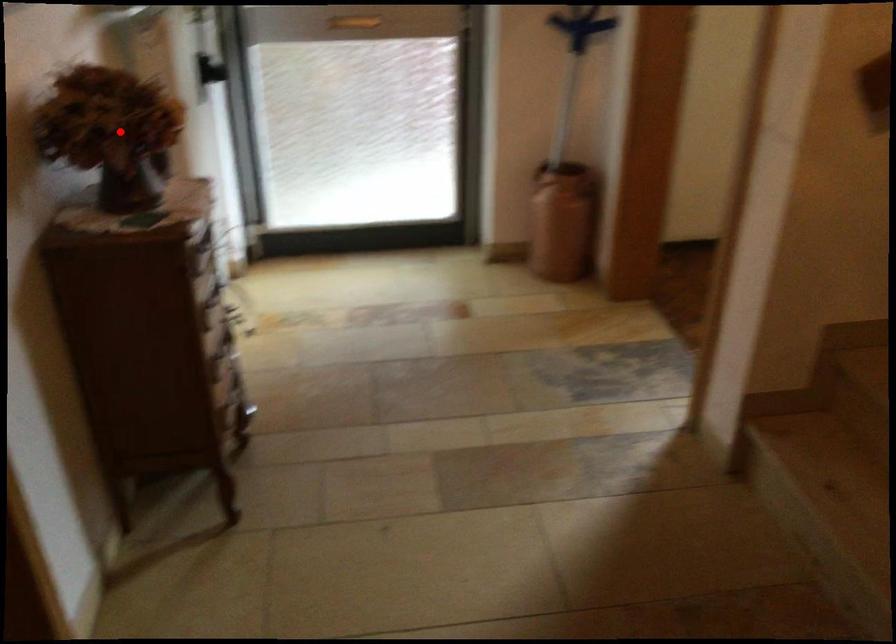
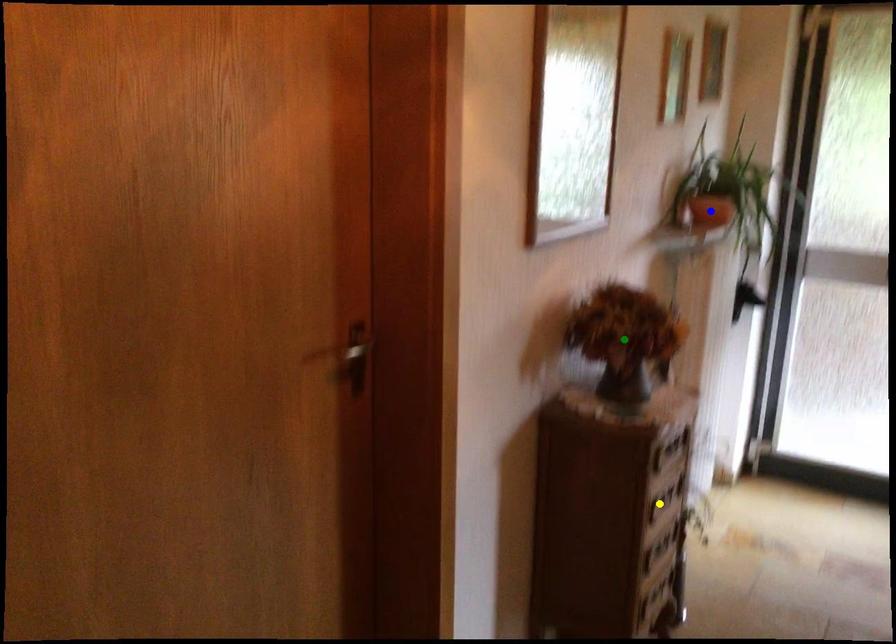
Question: I am providing you with two images of the same scene from different viewpoints. A red point is marked on the first image. You are given multiple points on the second image. Which point in image 2 is actually the same real-world point as the red point in image 1?

Choices:
 (A) green point
 (B) blue point
 (C) yellow point

Answer: (A)